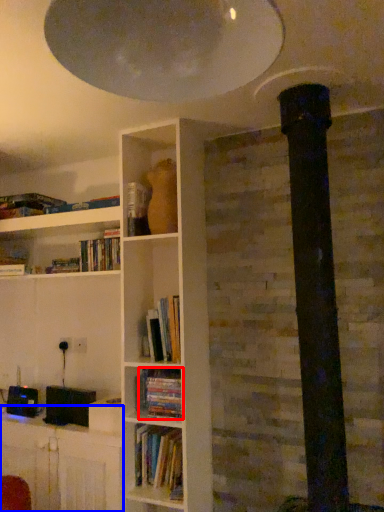
Question: Which point is further to the camera, book (highlighted by a red box) or table (highlighted by a blue box)?

Choices:
 (A) book
 (B) table

Answer: (A)